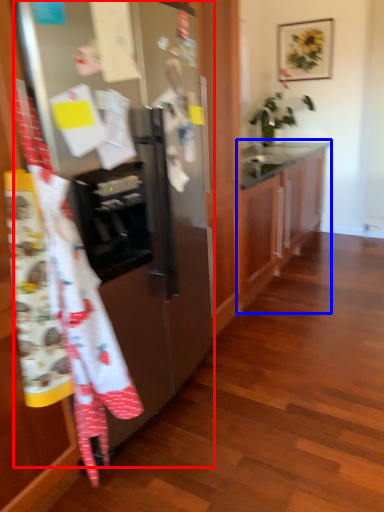
Question: Which object is closer to the camera taking this photo, refrigerator (highlighted by a red box) or cabinetry (highlighted by a blue box)?

Choices:
 (A) refrigerator
 (B) cabinetry

Answer: (A)